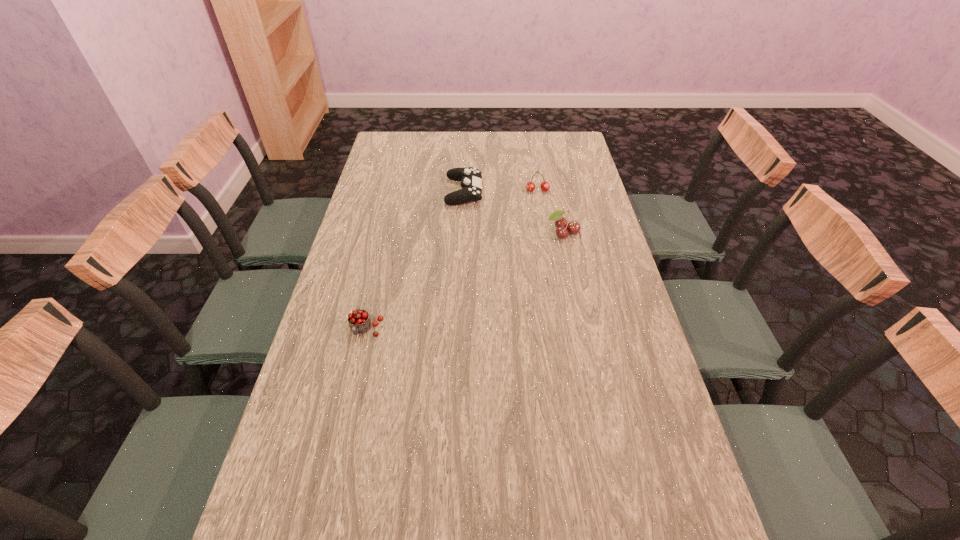
Where is `vacant space that satisfies the following two spatial constraints: 1. with stems pointing upwards on the farthest cherry; 2. on the surface of the second object from left to right`? vacant space that satisfies the following two spatial constraints: 1. with stems pointing upwards on the farthest cherry; 2. on the surface of the second object from left to right is located at coordinates (538, 192).

Identify the location of free space in the image that satisfies the following two spatial constraints: 1. on the surface of the control; 2. on the handle side of the nearest cherry. (458, 330).

Locate an element on the screen. The image size is (960, 540). blank space that satisfies the following two spatial constraints: 1. on the surface of the second object from left to right; 2. on the handle side of the leftmost cherry is located at coordinates (458, 330).